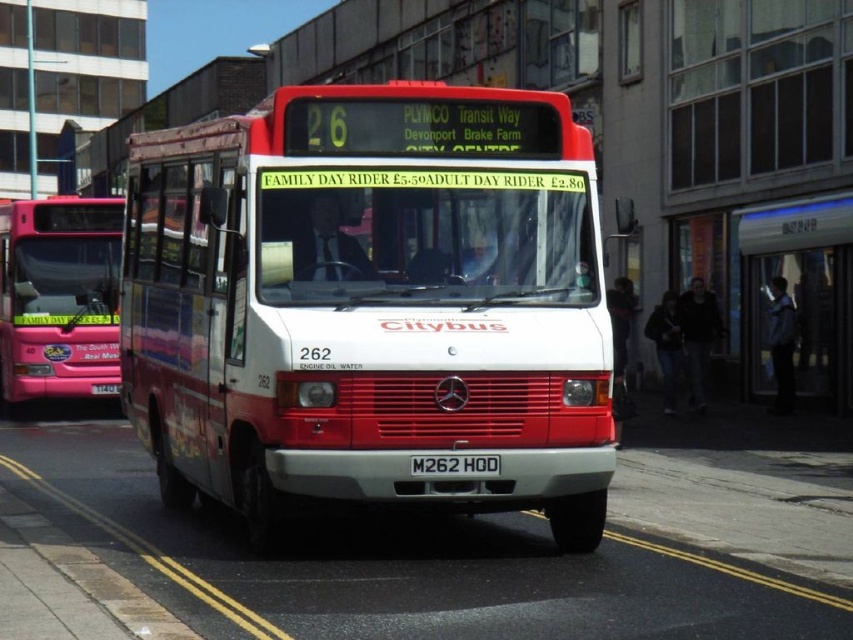
You are a pedestrian standing on the sidewalk watching the white matte bus at center and the matte pink bus at left. Which bus is closer to you?

The white matte bus at center is closer to you because it is in front of the matte pink bus at left.

You are standing on the sidewalk next to the red and white Citybus with route number 26. You notice two points marked on the bus. The first point is at coordinates point (277, 150) and the second is at point (418, 472). Which point is closer to you?

Point (277, 150) is further to the viewer than point (418, 472), so the point closer to you is point (418, 472).

You are a passenger waiting at the transparent glass bus stop at center. You notice the black plastic license plate at center on the bus. Can you see the entire license plate from your position at the bus stop?

The transparent glass bus stop at center is taller than the black plastic license plate at center, so yes, you can see the entire license plate from your position at the bus stop.